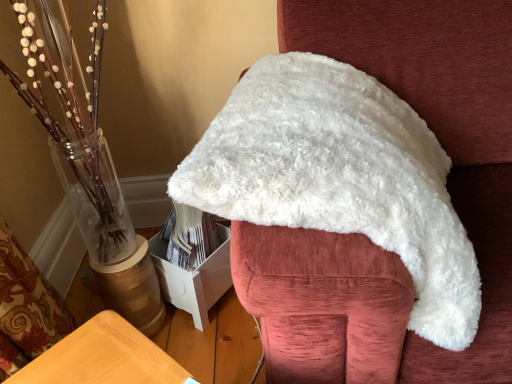
Locate an element on the screen. The image size is (512, 384). white fluffy blanket at upper center is located at coordinates (365, 236).

Describe the element at coordinates (365, 236) in the screenshot. I see `white fluffy blanket at upper center` at that location.

Find the location of `white fluffy blanket at upper center`. white fluffy blanket at upper center is located at coordinates (365, 236).